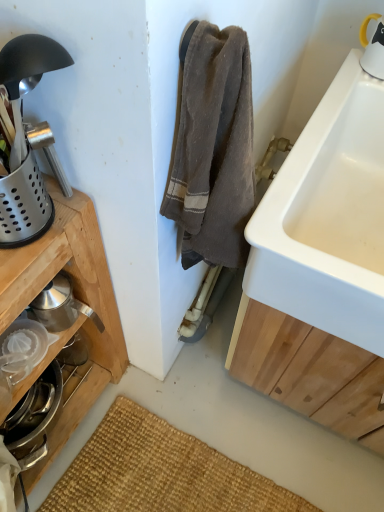
Question: Is white ceramic sink at right taller than stainless steel juicer at lower left?

Choices:
 (A) yes
 (B) no

Answer: (A)

Question: Does white ceramic sink at right have a lesser width compared to stainless steel juicer at lower left?

Choices:
 (A) yes
 (B) no

Answer: (B)

Question: Would you say white ceramic sink at right contains stainless steel juicer at lower left?

Choices:
 (A) no
 (B) yes

Answer: (A)

Question: Is white ceramic sink at right facing away from stainless steel juicer at lower left?

Choices:
 (A) no
 (B) yes

Answer: (A)

Question: Does white ceramic sink at right have a larger size compared to stainless steel juicer at lower left?

Choices:
 (A) no
 (B) yes

Answer: (B)

Question: Is there a large distance between white ceramic sink at right and stainless steel juicer at lower left?

Choices:
 (A) no
 (B) yes

Answer: (A)

Question: From a real-world perspective, does stainless steel juicer at lower left sit lower than white ceramic sink at right?

Choices:
 (A) yes
 (B) no

Answer: (A)

Question: Can you confirm if stainless steel juicer at lower left is taller than white ceramic sink at right?

Choices:
 (A) no
 (B) yes

Answer: (A)

Question: Is stainless steel juicer at lower left outside of white ceramic sink at right?

Choices:
 (A) yes
 (B) no

Answer: (A)

Question: From the image's perspective, is stainless steel juicer at lower left over white ceramic sink at right?

Choices:
 (A) yes
 (B) no

Answer: (B)

Question: Can you confirm if stainless steel juicer at lower left is smaller than white ceramic sink at right?

Choices:
 (A) yes
 (B) no

Answer: (A)

Question: Is stainless steel juicer at lower left facing away from white ceramic sink at right?

Choices:
 (A) no
 (B) yes

Answer: (A)

Question: Looking at their shapes, would you say stainless steel juicer at lower left is wider or thinner than white ceramic sink at right?

Choices:
 (A) thin
 (B) wide

Answer: (A)